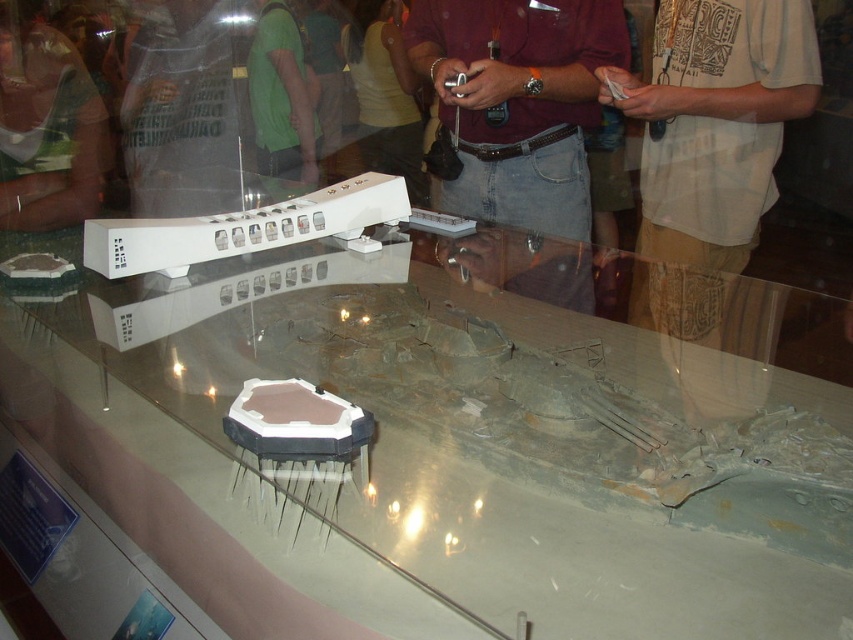
You are a visitor at the museum standing in front of the display case. You notice a transparent glass table at center and a maroon shirt at center. Which object is closer to you, the visitor?

The transparent glass table at center is positioned under the maroon shirt at center, so the maroon shirt at center is closer to you as it is above the table.

You are standing in front of the display case and want to see both the transparent glass table at center and the maroon shirt at center clearly. Which one is closer to you through the glass?

The transparent glass table at center is closer to you since it is in front of the maroon shirt at center within the display case.

You are a visitor standing in front of the display case and want to take a photo of the transparent glass table at center without the maroon shirt at center blocking the view. Which direction should you move to achieve this?

Move to the right so that the transparent glass table at center is no longer blocked by the maroon shirt at center, which is to its right.